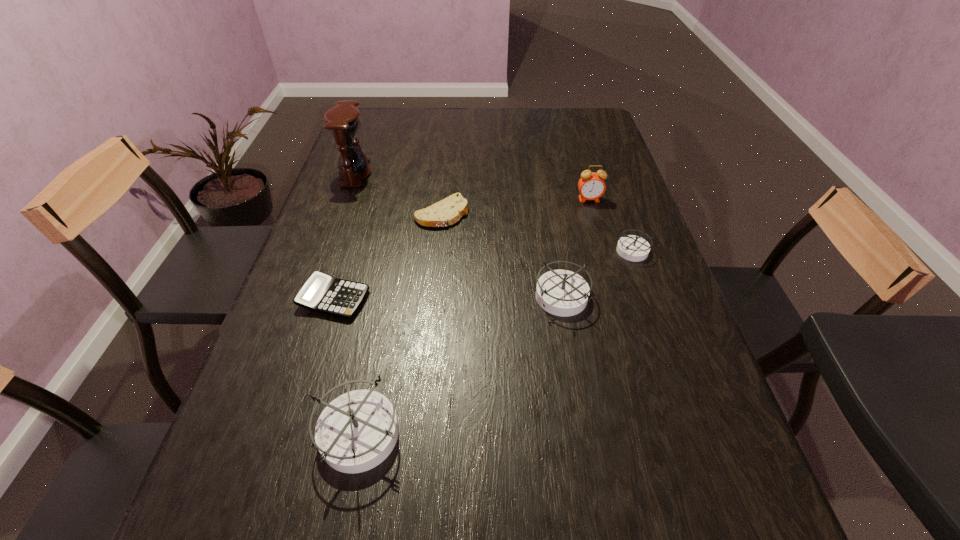
Identify the location of free space between the farthest object and the second compass from right to left. (459, 235).

You are a GUI agent. You are given a task and a screenshot of the screen. Output one action in this format:
    pyautogui.click(x=<x>, y=<y>)
    Task: Click on the free spot between the farthest compass and the leftmost compass
    The width and height of the screenshot is (960, 540).
    Given the screenshot: What is the action you would take?
    pyautogui.click(x=495, y=341)

This screenshot has width=960, height=540. I want to click on vacant point located between the rightmost compass and the pita bread, so click(538, 232).

Image resolution: width=960 pixels, height=540 pixels. Identify the location of free point between the second nearest compass and the nearest compass. (460, 365).

Locate an element on the screen. vacant space that's between the alarm clock and the second tallest compass is located at coordinates (575, 248).

Find the location of a particular element. unoccupied position between the second nearest compass and the shortest object is located at coordinates (502, 256).

Where is `free space that is in between the farthest object and the second farthest compass`? The width and height of the screenshot is (960, 540). free space that is in between the farthest object and the second farthest compass is located at coordinates (459, 235).

Locate an element on the screen. free space between the calculator and the tallest object is located at coordinates (345, 237).

Locate an element on the screen. free space between the alarm clock and the fourth farthest object is located at coordinates tap(612, 225).

Identify which object is the fourth nearest to the third object from right to left. Please provide its 2D coordinates. Your answer should be formatted as a tuple, i.e. [(x, y)], where the tuple contains the x and y coordinates of a point satisfying the conditions above.

[(357, 431)]